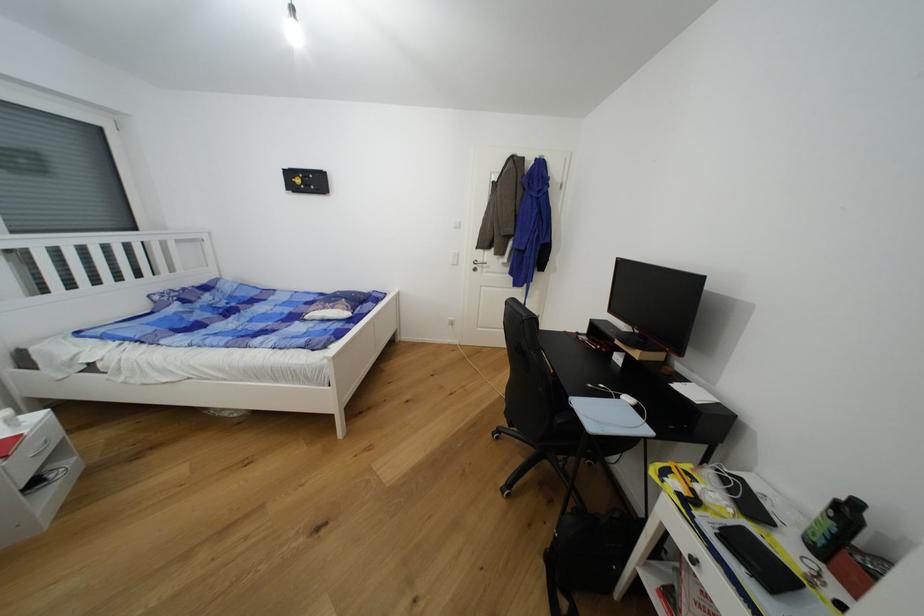
This screenshot has width=924, height=616. Find the location of `white drawer handle`. white drawer handle is located at coordinates (40, 451).